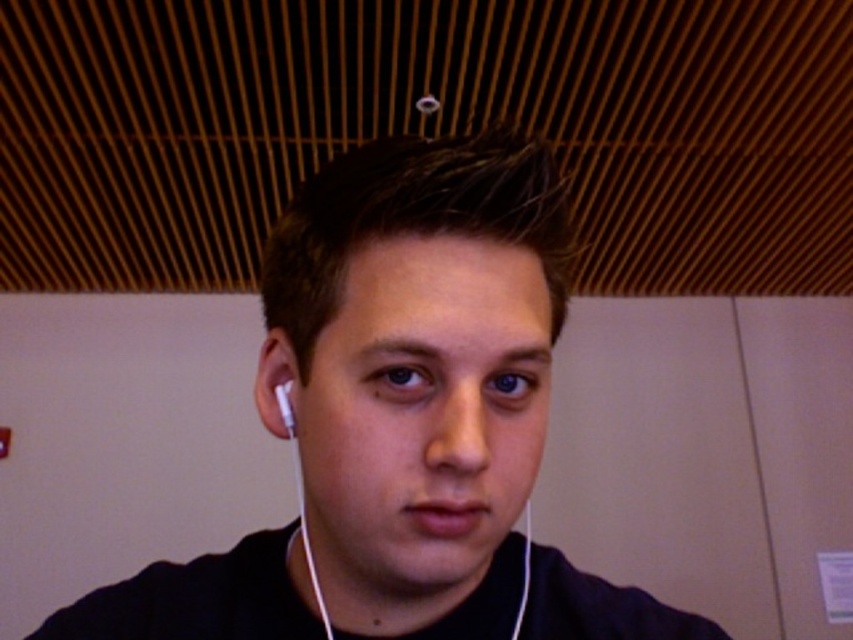
Question: Does black matte earphones at center have a greater width compared to white matte earphone at left?

Choices:
 (A) yes
 (B) no

Answer: (A)

Question: Which of the following is the closest to the observer?

Choices:
 (A) (288, 410)
 (B) (440, 595)
 (C) (283, 435)

Answer: (A)

Question: Can you confirm if white earbud at left is bigger than white matte earphone at left?

Choices:
 (A) no
 (B) yes

Answer: (B)

Question: Which object appears closest to the camera in this image?

Choices:
 (A) white earbud at left
 (B) white matte earphone at left

Answer: (A)

Question: Which point is farther to the camera?

Choices:
 (A) (351, 556)
 (B) (279, 410)

Answer: (B)

Question: Can you confirm if black matte earphones at center is bigger than white matte earphone at left?

Choices:
 (A) yes
 (B) no

Answer: (A)